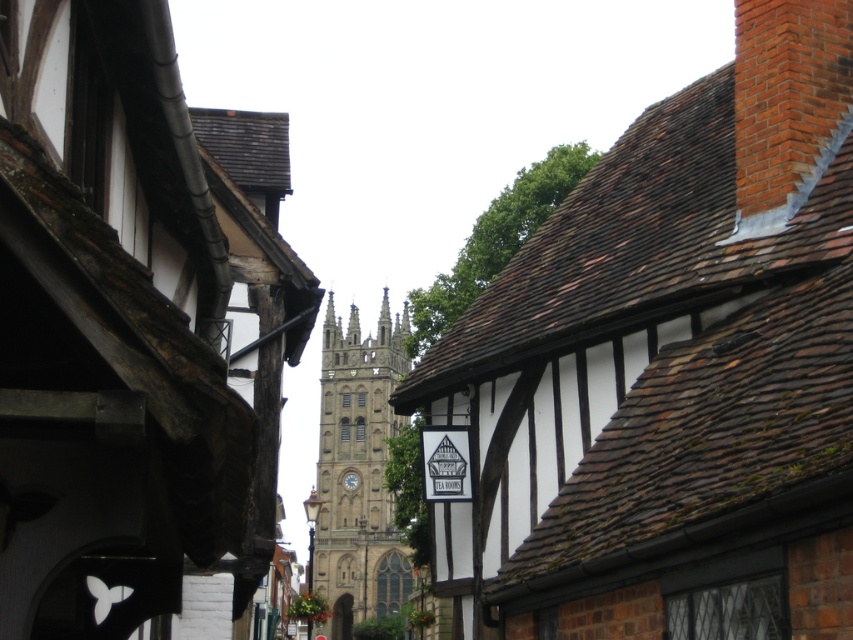
You are standing on the narrow street between the traditional half timbered buildings. You see a point marked at coordinates [135,330]. What does this point represent?

The point at coordinates [135,330] represents the brown stone tower at center.

You are a tourist standing at the end of the narrow street. You want to take a photo that includes both the brown tiled roof at upper center and the stone gothic tower at center. Given that your camera can capture a maximum distance of 120 meters between objects in focus, will you be able to capture both in the same photo?

The brown tiled roof at upper center is 115.24 meters away from the stone gothic tower at center. Since this distance is within the camera maximum of 120 meters, you can capture both in the same photo.